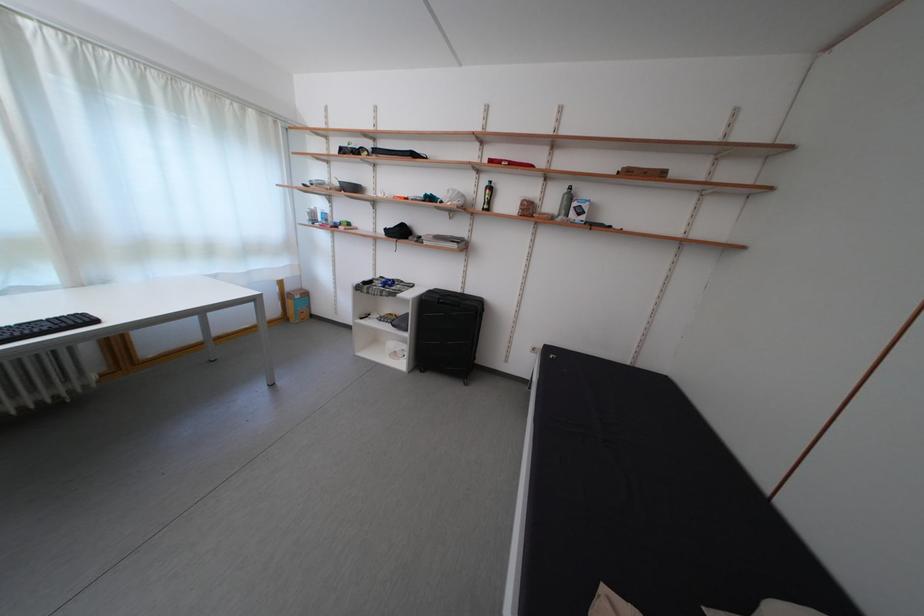
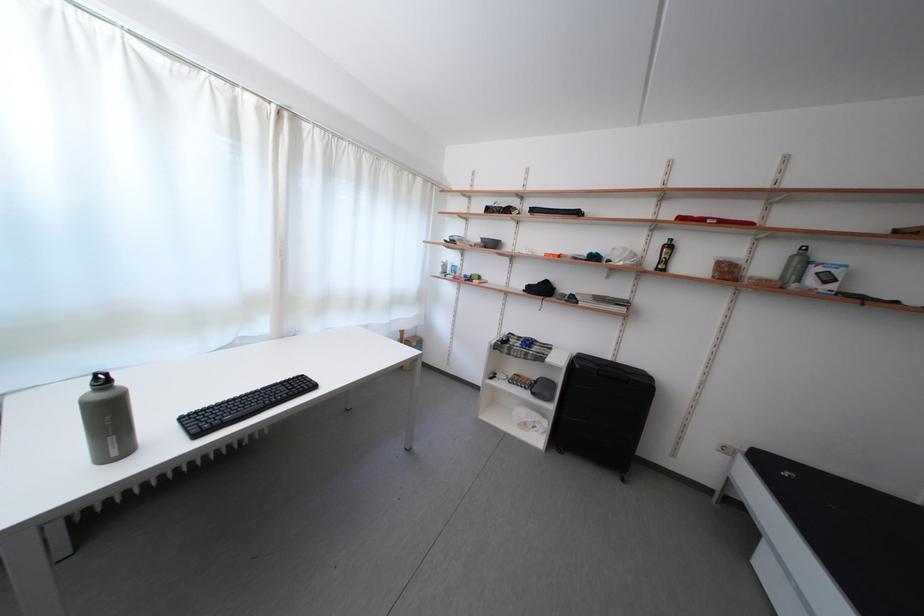
Find the pixel in the second image that matches pixel 468 296 in the first image.

(617, 363)